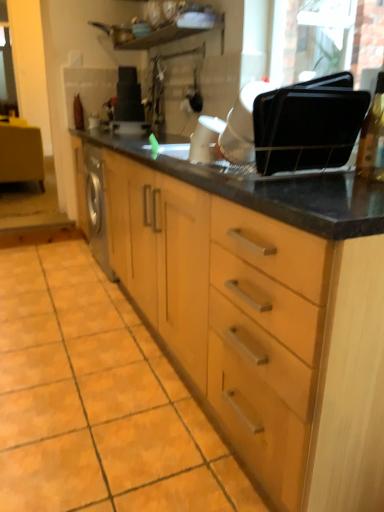
Identify the location of free space above orange matte tile at lower left (from a real-world perspective). (96, 359).